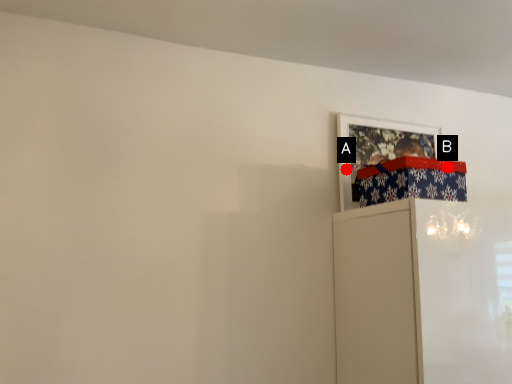
Question: Two points are circled on the image, labeled by A and B beside each circle. Which point appears closest to the camera in this image?

Choices:
 (A) A is closer
 (B) B is closer

Answer: (B)